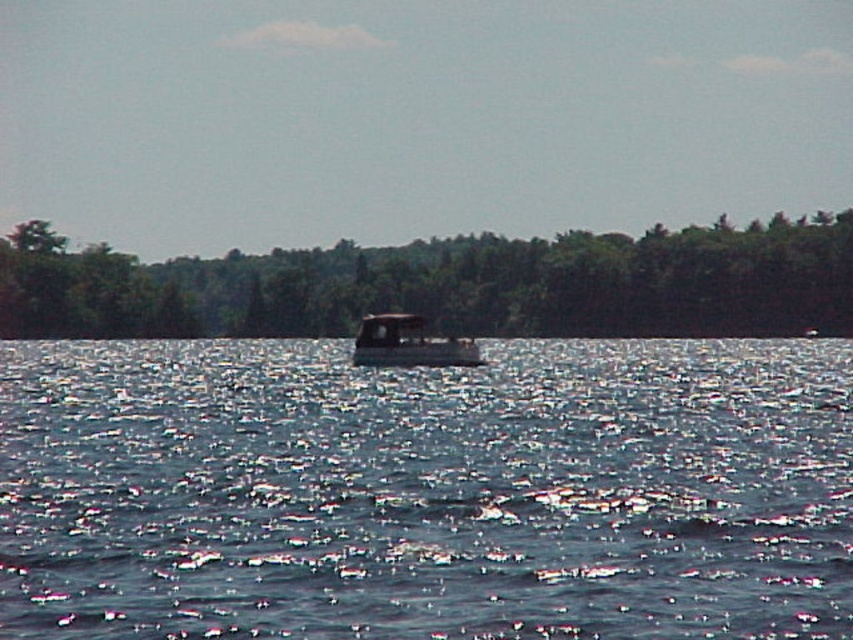
You are a photographer planning to capture the metallic gray boat at center and the green matte tree at center in a single frame. Based on the scene description, which object will appear larger in your photo?

The green matte tree at center is taller than the metallic gray boat at center, so it will appear larger in the photo.

You are a photographer planning to take a photo of the blue water at center and the metallic gray boat at center. Based on their positions, which object will appear larger in the photo?

The blue water at center will appear larger in the photo because it is closer to the photographer than the metallic gray boat at center, which is further away.

From the picture: You are standing on the deck of the boat in the middle ground and want to locate two points marked in the image. Which of the two points, point (352, 310) or point (422, 332), is closer to you?

Point (352, 310) is closer to you because it is further to the viewer than point (422, 332).